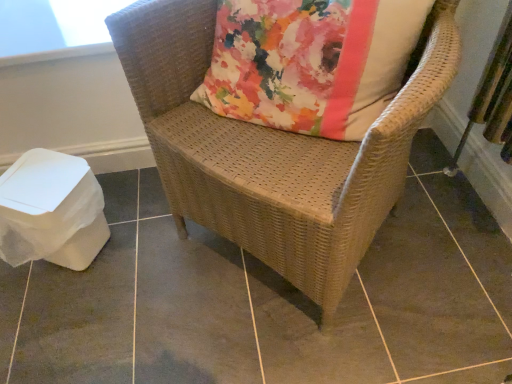
The height and width of the screenshot is (384, 512). Identify the location of free space in front of woven wicker chair at center. (323, 341).